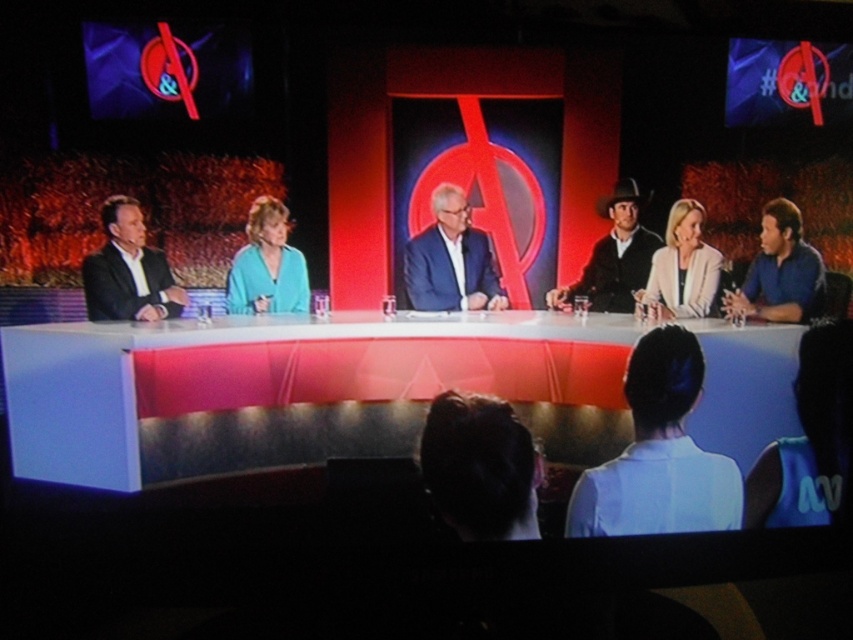
From the picture: You are a stagehand adjusting the microphones for the panel discussion. The two microphones are placed at point (440, 442) and another point. If the distance between them is 3.39 feet, what is the minimum length of the microphone cable needed to connect them without any slack?

The minimum length of the microphone cable needed to connect the two microphones at point (440, 442) and the other point is 3.39 feet, as the distance between them is exactly that.

You are a stagehand preparing to adjust the lighting for the panel discussion. You need to ensure that the blue suit at center and the blue shirt at right are both well lit. Given their positions, which one should you adjust the light first to reach from the back of the stage?

The blue suit at center is above the blue shirt at right, so you should adjust the light for the blue suit at center first as it is closer to the back of the stage.

You are a camera operator filming the panel discussion. You need to zoom in on both the blue suit at center and the blue shirt at right. Which one should you adjust your camera to focus on first if you want to follow the left to right viewing order?

You should first focus on the blue suit at center because it is to the left of the blue shirt at right, following the left to right viewing order.